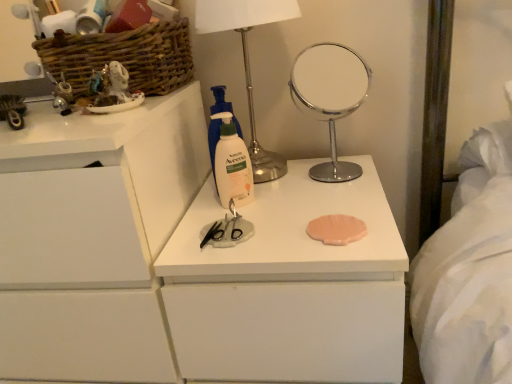
Question: Considering the relative sizes of polished chrome mirror at center and white matte chest of drawers at center, positioned as the 2th chest of drawers in left-to-right order, in the image provided, is polished chrome mirror at center smaller than white matte chest of drawers at center, positioned as the 2th chest of drawers in left-to-right order,?

Choices:
 (A) yes
 (B) no

Answer: (A)

Question: From a real-world perspective, does polished chrome mirror at center sit lower than white matte chest of drawers at center, which ranks as the 1th chest of drawers in right-to-left order?

Choices:
 (A) no
 (B) yes

Answer: (A)

Question: Is polished chrome mirror at center thinner than white matte chest of drawers at center, positioned as the 2th chest of drawers in left-to-right order?

Choices:
 (A) no
 (B) yes

Answer: (B)

Question: Are polished chrome mirror at center and white matte chest of drawers at center, positioned as the 2th chest of drawers in left-to-right order, far apart?

Choices:
 (A) no
 (B) yes

Answer: (B)

Question: Does polished chrome mirror at center come in front of white matte chest of drawers at center, which ranks as the 1th chest of drawers in right-to-left order?

Choices:
 (A) yes
 (B) no

Answer: (B)

Question: Is point (x=355, y=54) positioned closer to the camera than point (x=55, y=61)?

Choices:
 (A) closer
 (B) farther

Answer: (B)

Question: From a real-world perspective, is polished chrome mirror at center above or below woven brown basket at upper left?

Choices:
 (A) above
 (B) below

Answer: (B)

Question: Considering the positions of polished chrome mirror at center and woven brown basket at upper left in the image, is polished chrome mirror at center wider or thinner than woven brown basket at upper left?

Choices:
 (A) wide
 (B) thin

Answer: (B)

Question: From the image's perspective, relative to woven brown basket at upper left, is polished chrome mirror at center above or below?

Choices:
 (A) below
 (B) above

Answer: (A)

Question: Considering the positions of white matte aveeno lotion at center and polished chrome mirror at center in the image, is white matte aveeno lotion at center taller or shorter than polished chrome mirror at center?

Choices:
 (A) tall
 (B) short

Answer: (B)

Question: Based on their sizes in the image, would you say white matte aveeno lotion at center is bigger or smaller than polished chrome mirror at center?

Choices:
 (A) small
 (B) big

Answer: (A)

Question: Relative to polished chrome mirror at center, is white matte aveeno lotion at center in front or behind?

Choices:
 (A) behind
 (B) front

Answer: (B)

Question: From a real-world perspective, relative to polished chrome mirror at center, is white matte aveeno lotion at center vertically above or below?

Choices:
 (A) below
 (B) above

Answer: (A)

Question: Would you say white matte chest of drawers at left, which appears as the second chest of drawers when viewed from the right, is inside or outside white matte chest of drawers at center, positioned as the 2th chest of drawers in left-to-right order?

Choices:
 (A) outside
 (B) inside

Answer: (A)

Question: Is white matte chest of drawers at left, placed as the first chest of drawers when sorted from left to right, bigger or smaller than white matte chest of drawers at center, positioned as the 2th chest of drawers in left-to-right order?

Choices:
 (A) big
 (B) small

Answer: (A)